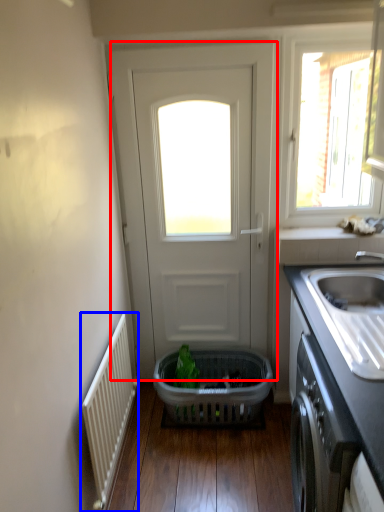
Question: Which object is closer to the camera taking this photo, door (highlighted by a red box) or radiator (highlighted by a blue box)?

Choices:
 (A) door
 (B) radiator

Answer: (B)